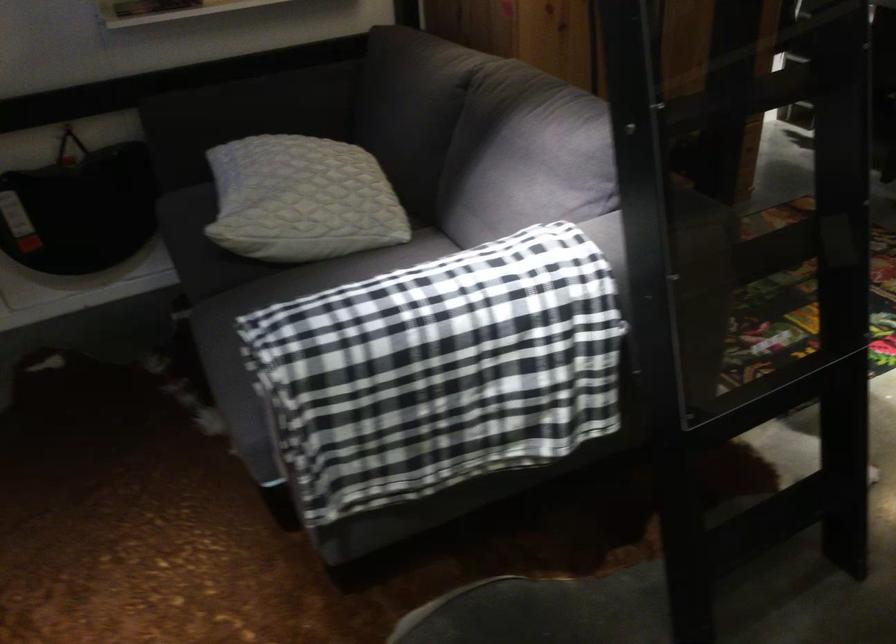
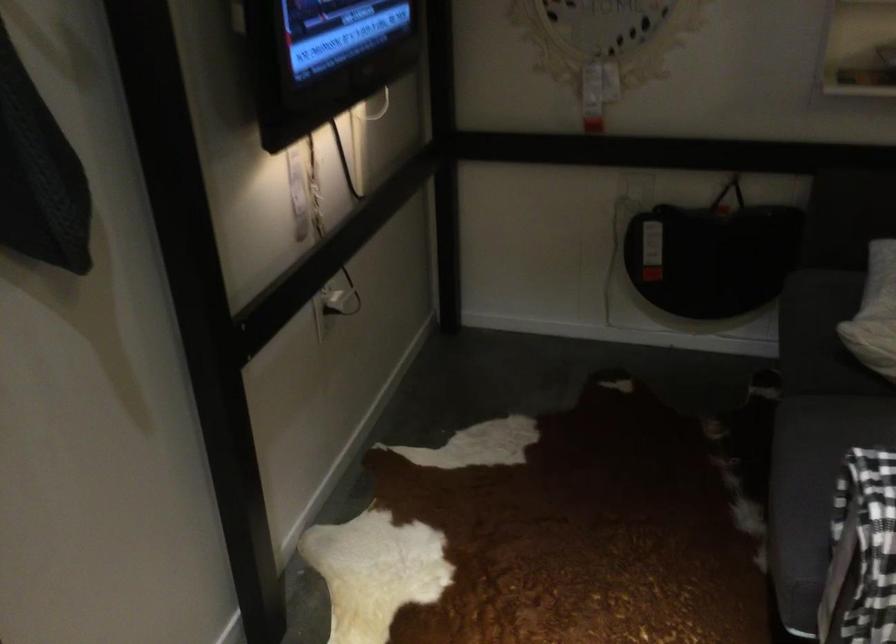
In the second image, find the point that corresponds to the point at 236,218 in the first image.

(874, 313)